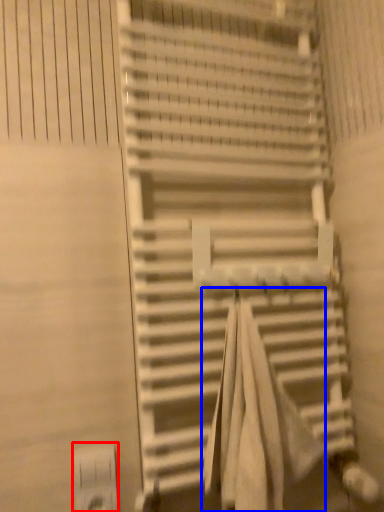
Question: Among these objects, which one is farthest to the camera, electric outlet (highlighted by a red box) or beach towel (highlighted by a blue box)?

Choices:
 (A) electric outlet
 (B) beach towel

Answer: (A)